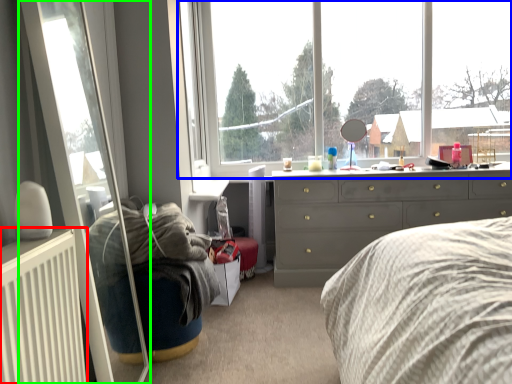
Question: Estimate the real-world distances between objects in this image. Which object is closer to radiator (highlighted by a red box), window (highlighted by a blue box) or glass door (highlighted by a green box)?

Choices:
 (A) window
 (B) glass door

Answer: (B)